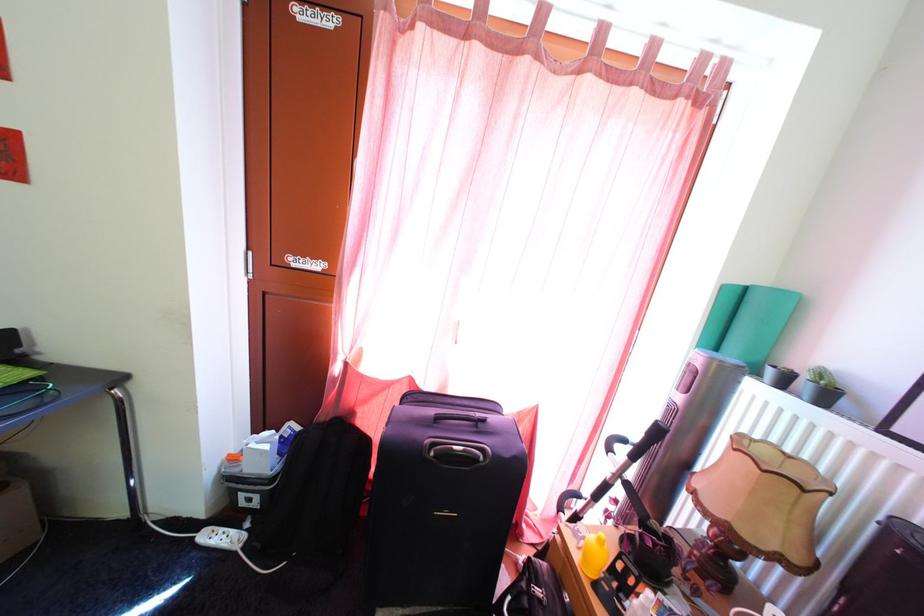
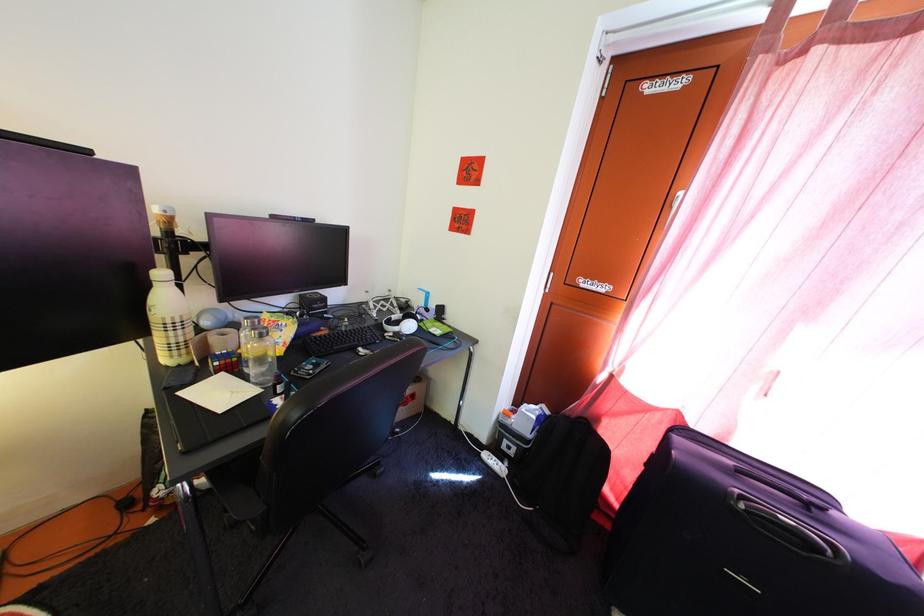
Question: The images are taken continuously from a first-person perspective. In which direction is your viewpoint rotating?

Choices:
 (A) Left
 (B) Right
 (C) Up
 (D) Down

Answer: (A)